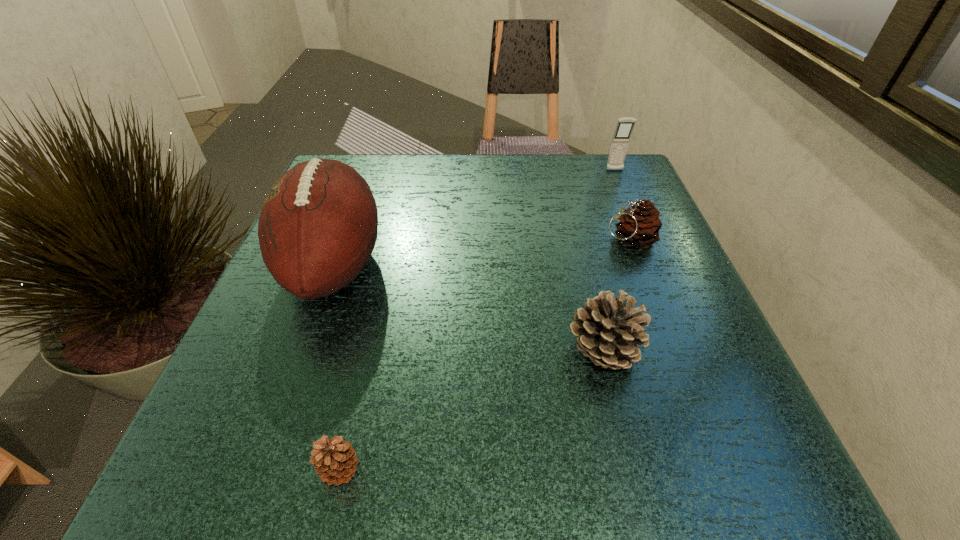
The height and width of the screenshot is (540, 960). I want to click on blank space located on the left of the second nearest pinecone, so click(x=484, y=351).

You are a GUI agent. You are given a task and a screenshot of the screen. Output one action in this format:
    pyautogui.click(x=<x>, y=<y>)
    Task: Click on the free space located with a leaf charm attached to the fourth tallest object
    The height and width of the screenshot is (540, 960).
    Given the screenshot: What is the action you would take?
    pyautogui.click(x=544, y=239)

This screenshot has height=540, width=960. What are the coordinates of `vacant area located 0.260m with a leaf charm attached to the fourth tallest object` in the screenshot? It's located at (475, 239).

Identify the location of vacant space located with a leaf charm attached to the fourth tallest object. This screenshot has width=960, height=540. (436, 239).

Where is `vacant position located 0.320m on the right of the nearest object`? vacant position located 0.320m on the right of the nearest object is located at coordinates (611, 470).

Where is `object at the far edge`? Image resolution: width=960 pixels, height=540 pixels. object at the far edge is located at coordinates (621, 138).

This screenshot has height=540, width=960. I want to click on object that is at the near edge, so click(335, 460).

Identify the location of object that is positioned at the left edge. Image resolution: width=960 pixels, height=540 pixels. (317, 229).

Where is `cellular telephone that is at the right edge`? cellular telephone that is at the right edge is located at coordinates (621, 138).

You are a GUI agent. You are given a task and a screenshot of the screen. Output one action in this format:
    pyautogui.click(x=<x>, y=<y>)
    Task: Click on the object that is at the far right corner
    This screenshot has width=960, height=540.
    Given the screenshot: What is the action you would take?
    pyautogui.click(x=621, y=138)